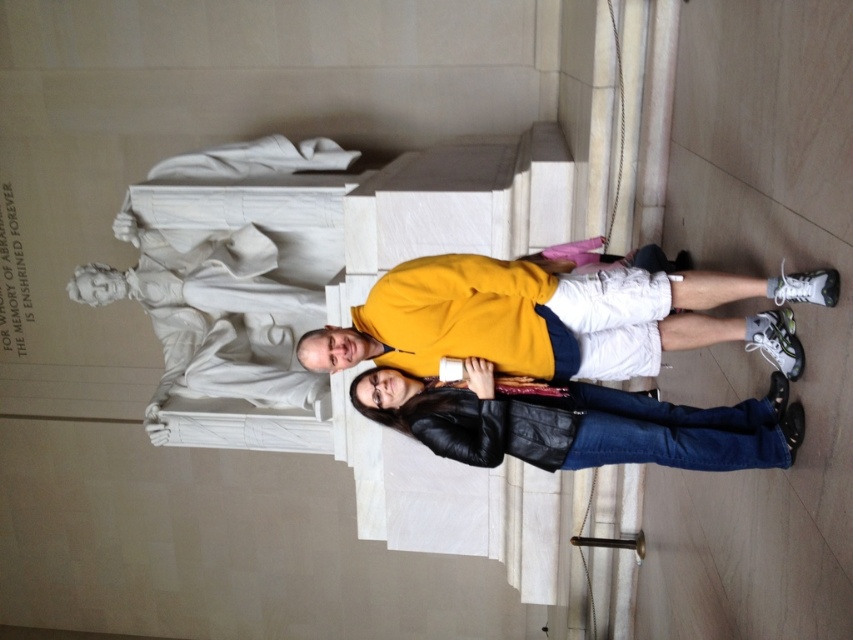
Is point (468, 339) positioned behind point (422, 403)?

No, (468, 339) is closer to viewer.

Is point (358, 339) positioned in front of point (709, 426)?

No.

Who is more forward, (x=610, y=301) or (x=486, y=369)?

Positioned in front is point (x=610, y=301).

Image resolution: width=853 pixels, height=640 pixels. I want to click on yellow matte sweatshirt at center, so click(547, 316).